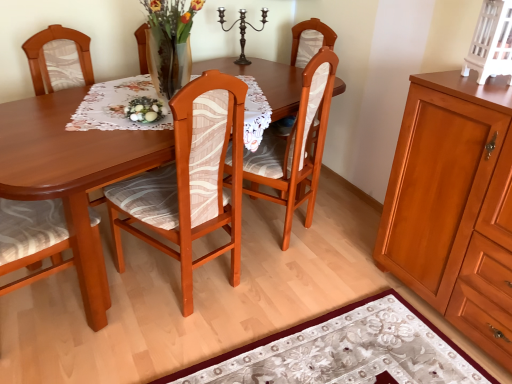
Locate an element on the screen. This screenshot has height=384, width=512. vacant space in between matte wood cabinet at right, placed as the second cabinetry when sorted from top to bottom, and wooden chair at center, marked as the first chair in a right-to-left arrangement is located at coordinates (349, 271).